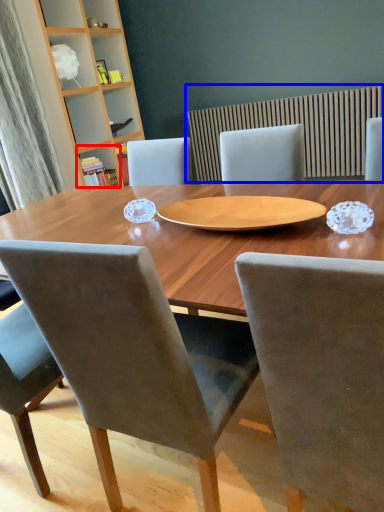
Question: Which object is closer to the camera taking this photo, shelf (highlighted by a red box) or radiator (highlighted by a blue box)?

Choices:
 (A) shelf
 (B) radiator

Answer: (B)